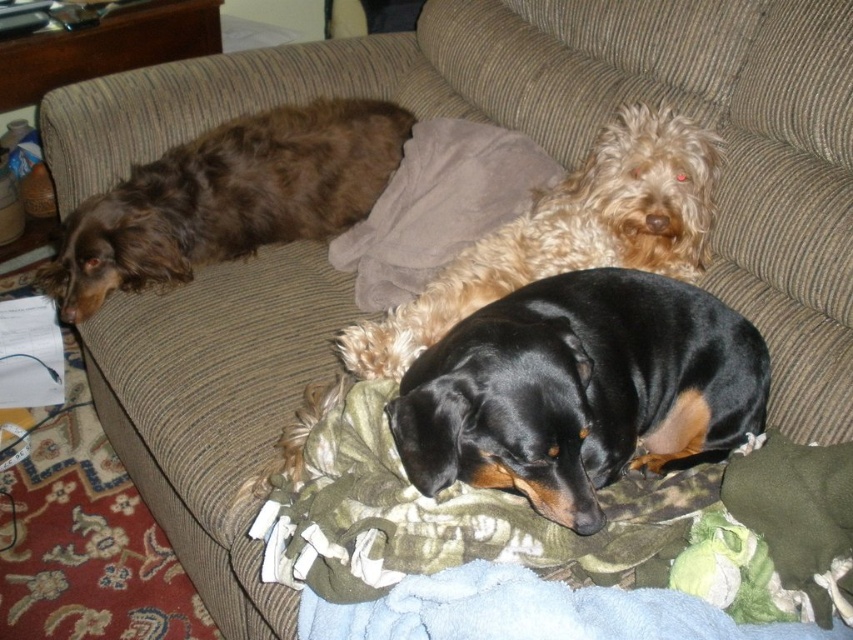
Question: Does brown shaggy dog at left have a larger size compared to shiny black coat at center?

Choices:
 (A) yes
 (B) no

Answer: (B)

Question: Which point is farther to the camera?

Choices:
 (A) (416, 460)
 (B) (277, 237)
 (C) (355, 522)

Answer: (B)

Question: Which of these objects is positioned closest to the shiny black coat at center?

Choices:
 (A) brown shaggy dog at left
 (B) camouflage fabric blanket at lower center

Answer: (B)

Question: Considering the relative positions of camouflage fabric blanket at lower center and shiny black coat at center in the image provided, where is camouflage fabric blanket at lower center located with respect to shiny black coat at center?

Choices:
 (A) above
 (B) below

Answer: (B)

Question: Among these points, which one is farthest from the camera?

Choices:
 (A) (299, 561)
 (B) (509, 285)
 (C) (605, 385)
 (D) (242, 240)

Answer: (D)

Question: Does camouflage fabric blanket at lower center appear over black smooth dachshund at center?

Choices:
 (A) yes
 (B) no

Answer: (B)